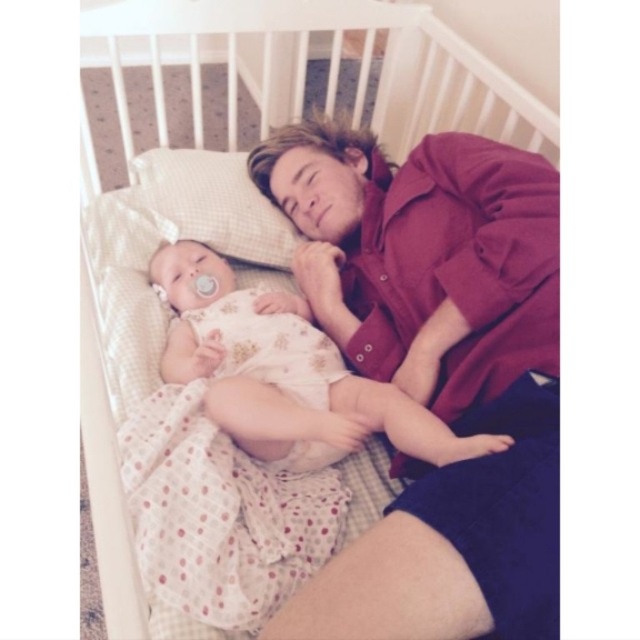
Based on the photo, you are a photographer holding a camera and want to capture a closeup of the floral cotton dress at center. Based on the scene description, can you determine if you can take the photo without moving the camera closer than 34.76 inches?

The floral cotton dress at center and camera are 34.76 inches apart, so yes, you can take a closeup photo without moving the camera closer than 34.76 inches.